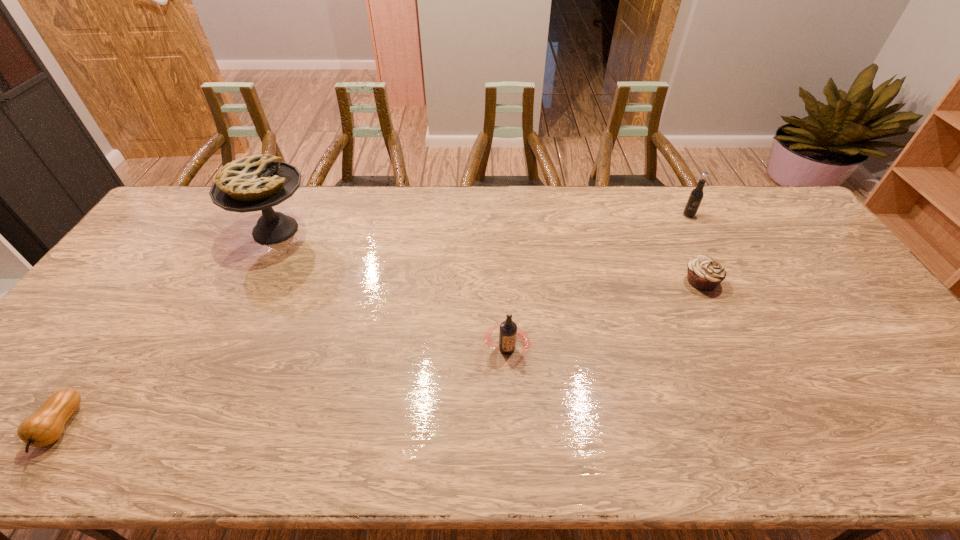
Find the location of a particular element. vacant area located on the label of the taller root beer is located at coordinates (732, 298).

What are the coordinates of `vacant space positioned on the label of the third shortest object` in the screenshot? It's located at tap(510, 406).

The width and height of the screenshot is (960, 540). I want to click on free spot located on the front of the muffin, so click(x=745, y=373).

Identify the location of pie located in the far edge section of the desktop. [253, 183].

This screenshot has height=540, width=960. Identify the location of root beer positioned at the far edge. (696, 195).

You are a GUI agent. You are given a task and a screenshot of the screen. Output one action in this format:
    pyautogui.click(x=<x>, y=<y>)
    Task: Click on the object that is at the near edge
    The width and height of the screenshot is (960, 540).
    Given the screenshot: What is the action you would take?
    pyautogui.click(x=43, y=428)

This screenshot has width=960, height=540. In order to click on object that is positioned at the left edge in this screenshot , I will do `click(43, 428)`.

Where is `object that is at the near left corner`? Image resolution: width=960 pixels, height=540 pixels. object that is at the near left corner is located at coordinates (43, 428).

Where is `vacant area at the far edge`? vacant area at the far edge is located at coordinates (601, 189).

The image size is (960, 540). In order to click on free space at the near edge of the desktop in this screenshot , I will do `click(456, 439)`.